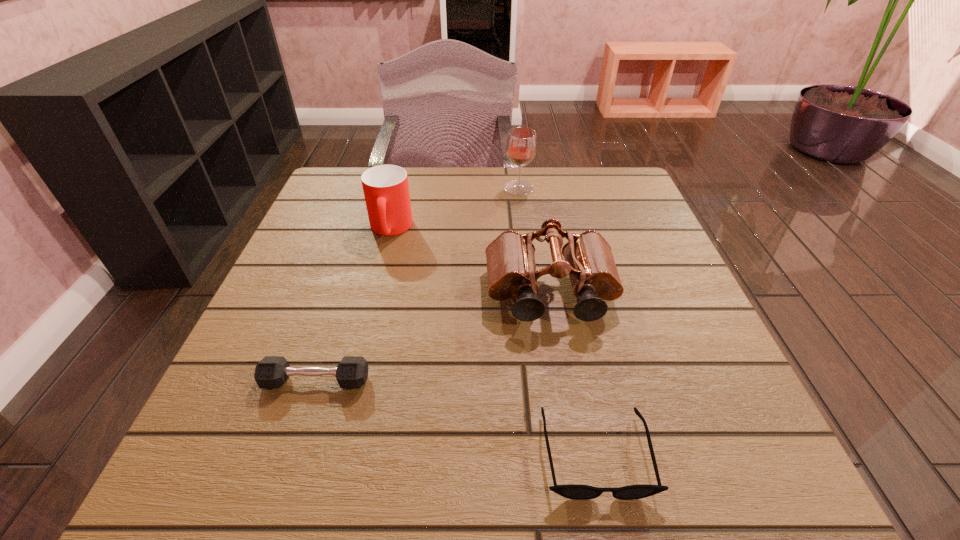
Where is `vacant region at the near edge`? This screenshot has width=960, height=540. vacant region at the near edge is located at coordinates click(x=585, y=438).

Locate an element on the screen. The width and height of the screenshot is (960, 540). free space at the left edge of the desktop is located at coordinates (284, 265).

In order to click on vacant space at the right edge in this screenshot , I will do `click(658, 420)`.

At what (x,y) coordinates should I click in order to perform the action: click on free space at the far left corner. Please return your answer as a coordinate pair (x, y). This screenshot has width=960, height=540. Looking at the image, I should click on (310, 217).

In the image, there is a desktop. Identify the location of vacant space at the far right corner. (593, 174).

Locate an element on the screen. vacant space in between the fourth farthest object and the wineglass is located at coordinates (418, 285).

Where is `free space between the dumbbell and the fourth nearest object`? The height and width of the screenshot is (540, 960). free space between the dumbbell and the fourth nearest object is located at coordinates (353, 305).

Locate an element on the screen. The height and width of the screenshot is (540, 960). unoccupied position between the second nearest object and the binoculars is located at coordinates (433, 337).

I want to click on free space that is in between the binoculars and the cup, so click(x=470, y=261).

The height and width of the screenshot is (540, 960). I want to click on vacant area between the third farthest object and the tallest object, so click(535, 241).